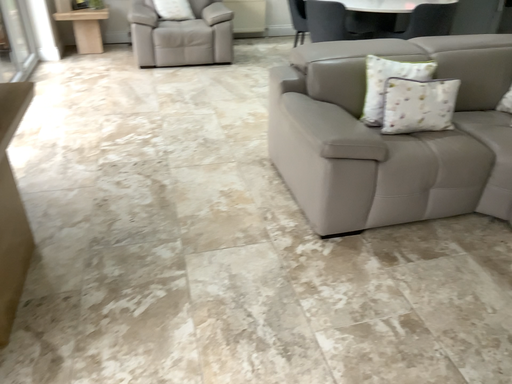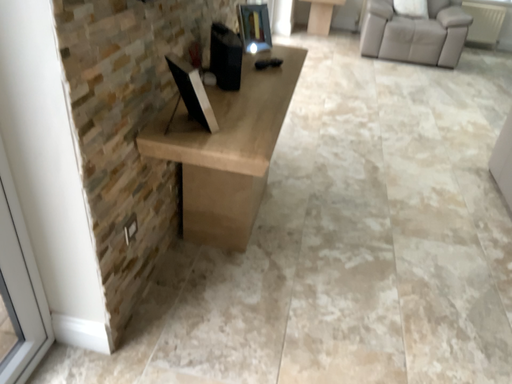
Question: Which way did the camera rotate in the video?

Choices:
 (A) rotated left
 (B) rotated right

Answer: (A)